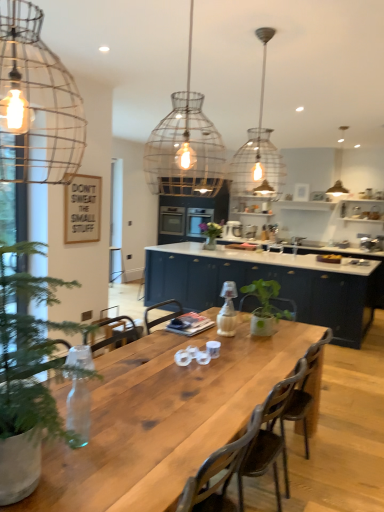
Where is `free region under wire mesh pendant light at center (from a real-world perspective)`? free region under wire mesh pendant light at center (from a real-world perspective) is located at coordinates (159, 385).